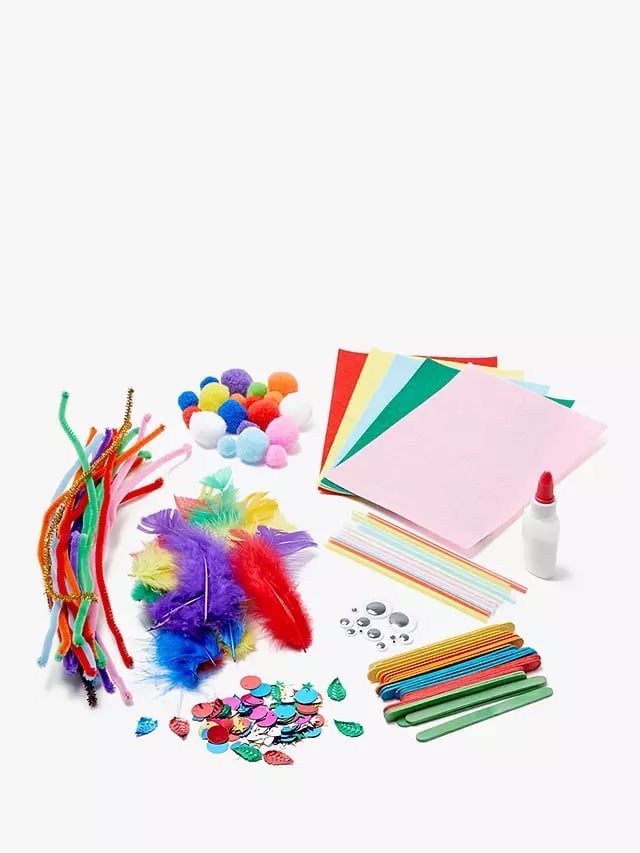
You are a GUI agent. You are given a task and a screenshot of the screen. Output one action in this format:
    pyautogui.click(x=<x>, y=<y>)
    Task: Click on the craft supplies
    The image size is (640, 853).
    Given the screenshot: What is the action you would take?
    pyautogui.click(x=394, y=453), pyautogui.click(x=259, y=560), pyautogui.click(x=77, y=531), pyautogui.click(x=212, y=419), pyautogui.click(x=267, y=716), pyautogui.click(x=448, y=686), pyautogui.click(x=530, y=530), pyautogui.click(x=431, y=571), pyautogui.click(x=371, y=639)